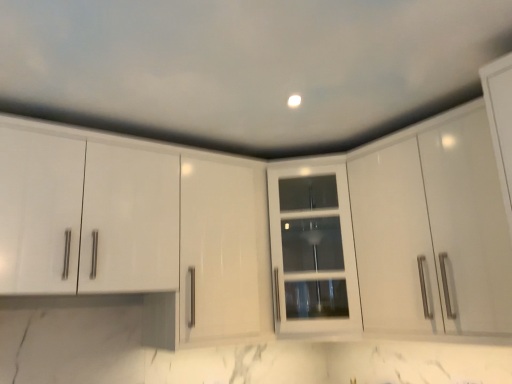
In order to face glossy white cabinet at upper right, which is counted as the second cabinetry, starting from the left, should I rotate leftwards or rightwards?

Rotate your view right by about 24.683°.

What do you see at coordinates (433, 232) in the screenshot? This screenshot has height=384, width=512. I see `glossy white cabinet at upper right, the first cabinetry positioned from the right` at bounding box center [433, 232].

Identify the location of glossy white cabinet at upper right, the first cabinetry positioned from the right. (433, 232).

Locate an element on the screen. The height and width of the screenshot is (384, 512). white glass cabinet at center, the 2th cabinetry when ordered from right to left is located at coordinates (312, 251).

The height and width of the screenshot is (384, 512). What do you see at coordinates (312, 251) in the screenshot?
I see `white glass cabinet at center, which ranks as the first cabinetry in left-to-right order` at bounding box center [312, 251].

What is the approximate width of white glass cabinet at center, which ranks as the first cabinetry in left-to-right order?

It is 16.66 inches.

Where is `glossy white cabinet at upper right, which is counted as the second cabinetry, starting from the left`? The height and width of the screenshot is (384, 512). glossy white cabinet at upper right, which is counted as the second cabinetry, starting from the left is located at coordinates (433, 232).

Considering the positions of objects white glass cabinet at center, the 2th cabinetry when ordered from right to left, and glossy white cabinet at upper right, which is counted as the second cabinetry, starting from the left, in the image provided, who is more to the right, white glass cabinet at center, the 2th cabinetry when ordered from right to left, or glossy white cabinet at upper right, which is counted as the second cabinetry, starting from the left,?

Positioned to the right is glossy white cabinet at upper right, which is counted as the second cabinetry, starting from the left.

Who is more distant, white glass cabinet at center, which ranks as the first cabinetry in left-to-right order, or glossy white cabinet at upper right, which is counted as the second cabinetry, starting from the left?

Positioned behind is white glass cabinet at center, which ranks as the first cabinetry in left-to-right order.

Does point (336, 179) appear closer or farther from the camera than point (424, 323)?

Point (336, 179) is positioned farther from the camera compared to point (424, 323).

From the image's perspective, is white glass cabinet at center, which ranks as the first cabinetry in left-to-right order, below glossy white cabinet at upper right, the first cabinetry positioned from the right?

Indeed, from the image's perspective, white glass cabinet at center, which ranks as the first cabinetry in left-to-right order, is shown beneath glossy white cabinet at upper right, the first cabinetry positioned from the right.

From a real-world perspective, is white glass cabinet at center, the 2th cabinetry when ordered from right to left, physically located above or below glossy white cabinet at upper right, the first cabinetry positioned from the right?

From a real-world perspective, white glass cabinet at center, the 2th cabinetry when ordered from right to left, is physically below glossy white cabinet at upper right, the first cabinetry positioned from the right.

Which object is thinner, white glass cabinet at center, the 2th cabinetry when ordered from right to left, or glossy white cabinet at upper right, the first cabinetry positioned from the right?

glossy white cabinet at upper right, the first cabinetry positioned from the right, is thinner.

Which of these two, white glass cabinet at center, the 2th cabinetry when ordered from right to left, or glossy white cabinet at upper right, the first cabinetry positioned from the right, stands shorter?

white glass cabinet at center, the 2th cabinetry when ordered from right to left.

Considering the sizes of objects white glass cabinet at center, the 2th cabinetry when ordered from right to left, and glossy white cabinet at upper right, the first cabinetry positioned from the right, in the image provided, who is smaller, white glass cabinet at center, the 2th cabinetry when ordered from right to left, or glossy white cabinet at upper right, the first cabinetry positioned from the right,?

Smaller between the two is white glass cabinet at center, the 2th cabinetry when ordered from right to left.

In the scene shown: Would you say white glass cabinet at center, which ranks as the first cabinetry in left-to-right order, contains glossy white cabinet at upper right, the first cabinetry positioned from the right?

No, glossy white cabinet at upper right, the first cabinetry positioned from the right, is not inside white glass cabinet at center, which ranks as the first cabinetry in left-to-right order.

Are white glass cabinet at center, which ranks as the first cabinetry in left-to-right order, and glossy white cabinet at upper right, which is counted as the second cabinetry, starting from the left, making contact?

There is a gap between white glass cabinet at center, which ranks as the first cabinetry in left-to-right order, and glossy white cabinet at upper right, which is counted as the second cabinetry, starting from the left.

Is white glass cabinet at center, the 2th cabinetry when ordered from right to left, looking in the opposite direction of glossy white cabinet at upper right, the first cabinetry positioned from the right?

No, white glass cabinet at center, the 2th cabinetry when ordered from right to left,'s orientation is not away from glossy white cabinet at upper right, the first cabinetry positioned from the right.

Could you measure the distance between white glass cabinet at center, the 2th cabinetry when ordered from right to left, and glossy white cabinet at upper right, the first cabinetry positioned from the right?

The distance of white glass cabinet at center, the 2th cabinetry when ordered from right to left, from glossy white cabinet at upper right, the first cabinetry positioned from the right, is 13.23 inches.

You are a GUI agent. You are given a task and a screenshot of the screen. Output one action in this format:
    pyautogui.click(x=<x>, y=<y>)
    Task: Click on the cabinetry that is above the white glass cabinet at center, which ranks as the first cabinetry in left-to-right order (from a real-world perspective)
    This screenshot has height=384, width=512.
    Given the screenshot: What is the action you would take?
    pyautogui.click(x=433, y=232)

Does glossy white cabinet at upper right, which is counted as the second cabinetry, starting from the left, appear on the left side of white glass cabinet at center, the 2th cabinetry when ordered from right to left?

In fact, glossy white cabinet at upper right, which is counted as the second cabinetry, starting from the left, is to the right of white glass cabinet at center, the 2th cabinetry when ordered from right to left.

Is glossy white cabinet at upper right, which is counted as the second cabinetry, starting from the left, positioned in front of white glass cabinet at center, the 2th cabinetry when ordered from right to left?

That is True.

Is point (423, 169) positioned before point (345, 173)?

Yes, it is.

From the image's perspective, which is below, glossy white cabinet at upper right, the first cabinetry positioned from the right, or white glass cabinet at center, which ranks as the first cabinetry in left-to-right order?

From the image's view, white glass cabinet at center, which ranks as the first cabinetry in left-to-right order, is below.

From a real-world perspective, does glossy white cabinet at upper right, the first cabinetry positioned from the right, stand above white glass cabinet at center, the 2th cabinetry when ordered from right to left?

Correct, in the physical world, glossy white cabinet at upper right, the first cabinetry positioned from the right, is higher than white glass cabinet at center, the 2th cabinetry when ordered from right to left.

Is glossy white cabinet at upper right, which is counted as the second cabinetry, starting from the left, wider or thinner than white glass cabinet at center, the 2th cabinetry when ordered from right to left?

Considering their sizes, glossy white cabinet at upper right, which is counted as the second cabinetry, starting from the left, looks slimmer than white glass cabinet at center, the 2th cabinetry when ordered from right to left.

Considering the sizes of glossy white cabinet at upper right, which is counted as the second cabinetry, starting from the left, and white glass cabinet at center, the 2th cabinetry when ordered from right to left, in the image, is glossy white cabinet at upper right, which is counted as the second cabinetry, starting from the left, taller or shorter than white glass cabinet at center, the 2th cabinetry when ordered from right to left,?

Clearly, glossy white cabinet at upper right, which is counted as the second cabinetry, starting from the left, is taller compared to white glass cabinet at center, the 2th cabinetry when ordered from right to left.

In the scene shown: Considering the sizes of objects glossy white cabinet at upper right, the first cabinetry positioned from the right, and white glass cabinet at center, the 2th cabinetry when ordered from right to left, in the image provided, who is smaller, glossy white cabinet at upper right, the first cabinetry positioned from the right, or white glass cabinet at center, the 2th cabinetry when ordered from right to left,?

white glass cabinet at center, the 2th cabinetry when ordered from right to left.

From the picture: Would you say glossy white cabinet at upper right, which is counted as the second cabinetry, starting from the left, is inside or outside white glass cabinet at center, which ranks as the first cabinetry in left-to-right order?

glossy white cabinet at upper right, which is counted as the second cabinetry, starting from the left, is not enclosed by white glass cabinet at center, which ranks as the first cabinetry in left-to-right order.

Are glossy white cabinet at upper right, the first cabinetry positioned from the right, and white glass cabinet at center, which ranks as the first cabinetry in left-to-right order, making contact?

glossy white cabinet at upper right, the first cabinetry positioned from the right, and white glass cabinet at center, which ranks as the first cabinetry in left-to-right order, are clearly separated.

Is glossy white cabinet at upper right, which is counted as the second cabinetry, starting from the left, facing towards white glass cabinet at center, which ranks as the first cabinetry in left-to-right order?

No, glossy white cabinet at upper right, which is counted as the second cabinetry, starting from the left, is not turned towards white glass cabinet at center, which ranks as the first cabinetry in left-to-right order.

Based on the photo, how different are the orientations of glossy white cabinet at upper right, which is counted as the second cabinetry, starting from the left, and white glass cabinet at center, the 2th cabinetry when ordered from right to left, in degrees?

The facing directions of glossy white cabinet at upper right, which is counted as the second cabinetry, starting from the left, and white glass cabinet at center, the 2th cabinetry when ordered from right to left, are 36.8 degrees apart.

I want to click on cabinetry located below the glossy white cabinet at upper right, which is counted as the second cabinetry, starting from the left (from the image's perspective), so click(312, 251).

Image resolution: width=512 pixels, height=384 pixels. In order to click on cabinetry below the glossy white cabinet at upper right, the first cabinetry positioned from the right (from a real-world perspective) in this screenshot , I will do `click(312, 251)`.

The image size is (512, 384). I want to click on cabinetry lying above the white glass cabinet at center, which ranks as the first cabinetry in left-to-right order (from the image's perspective), so click(433, 232).